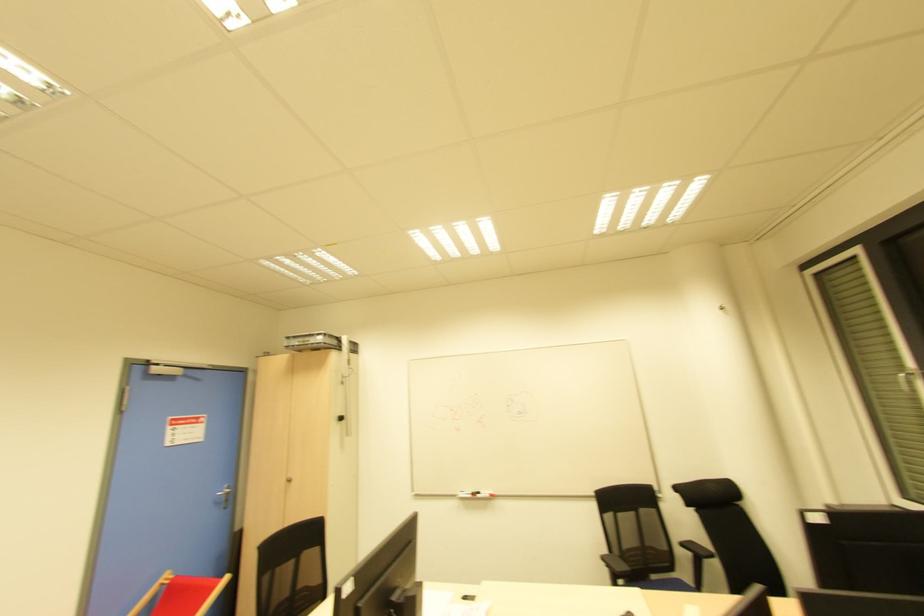
Locate an element on the screen. chair sitting surface is located at coordinates (670, 578).